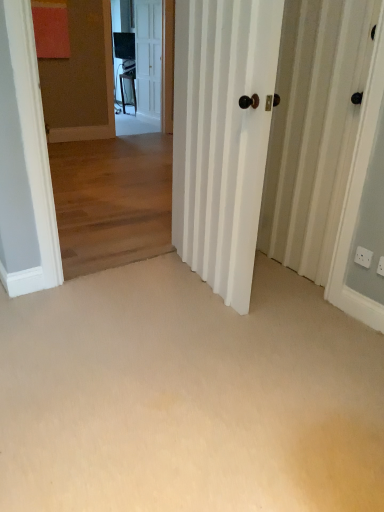
This screenshot has height=512, width=384. Find the location of `wooden floor at center, acting as the 2th corridor starting from the bottom`. wooden floor at center, acting as the 2th corridor starting from the bottom is located at coordinates (100, 158).

Describe the element at coordinates (314, 129) in the screenshot. The height and width of the screenshot is (512, 384). I see `white striped barn door at right` at that location.

This screenshot has width=384, height=512. Describe the element at coordinates (151, 55) in the screenshot. I see `white glossy screen door at upper center` at that location.

This screenshot has height=512, width=384. What do you see at coordinates (188, 396) in the screenshot?
I see `beige carpet at center, which appears as the first corridor when ordered from the bottom` at bounding box center [188, 396].

What do you see at coordinates (148, 57) in the screenshot?
I see `white wooden door at upper center, the 2th door ordered from the bottom` at bounding box center [148, 57].

At what (x,y) coordinates should I click in order to perform the action: click on white plastic electric outlet at lower right, positioned as the first electric outlet in back-to-front order. Please return your answer as a coordinate pair (x, y). The height and width of the screenshot is (512, 384). Looking at the image, I should click on (363, 257).

Can you confirm if white glossy door at center, which is counted as the 1th door, starting from the bottom, is bigger than white plastic electric outlet at lower right, arranged as the second electric outlet when viewed from the right?

Indeed, white glossy door at center, which is counted as the 1th door, starting from the bottom, has a larger size compared to white plastic electric outlet at lower right, arranged as the second electric outlet when viewed from the right.

Which point is more distant from viewer, [259,103] or [369,266]?

The point [369,266] is farther.

Is white glossy door at center, which appears as the first door when viewed from the right, not within white plastic electric outlet at lower right, the 1th electric outlet when ordered from left to right?

white glossy door at center, which appears as the first door when viewed from the right, is positioned outside white plastic electric outlet at lower right, the 1th electric outlet when ordered from left to right.

Is white plastic electric outlet at lower right, positioned as the first electric outlet in back-to-front order, at the back of white glossy door at center, the second door positioned from the back?

No, white glossy door at center, the second door positioned from the back,'s orientation is not away from white plastic electric outlet at lower right, positioned as the first electric outlet in back-to-front order.

Based on the photo, from a real-world perspective, is white glossy door at center, marked as the 2th door in a top-to-bottom arrangement, physically above white glossy screen door at upper center?

Incorrect, from a real-world perspective, white glossy door at center, marked as the 2th door in a top-to-bottom arrangement, is lower than white glossy screen door at upper center.

Considering the positions of objects white glossy door at center, marked as the first door in a front-to-back arrangement, and white glossy screen door at upper center in the image provided, who is more to the left, white glossy door at center, marked as the first door in a front-to-back arrangement, or white glossy screen door at upper center?

From the viewer's perspective, white glossy screen door at upper center appears more on the left side.

Is white glossy door at center, the second door positioned from the back, in front of or behind white glossy screen door at upper center in the image?

Clearly, white glossy door at center, the second door positioned from the back, is in front of white glossy screen door at upper center.

Considering the relative sizes of white glossy door at center, marked as the first door in a front-to-back arrangement, and beige carpet at center, which is counted as the second corridor, starting from the top, in the image provided, is white glossy door at center, marked as the first door in a front-to-back arrangement, thinner than beige carpet at center, which is counted as the second corridor, starting from the top,?

Yes, white glossy door at center, marked as the first door in a front-to-back arrangement, is thinner than beige carpet at center, which is counted as the second corridor, starting from the top.

Based on their positions, is white glossy door at center, which appears as the first door when viewed from the right, located to the left or right of beige carpet at center, which appears as the first corridor when ordered from the bottom?

In the image, white glossy door at center, which appears as the first door when viewed from the right, appears on the right side of beige carpet at center, which appears as the first corridor when ordered from the bottom.

Which of these two, white glossy door at center, which is counted as the 1th door, starting from the bottom, or beige carpet at center, which is counted as the second corridor, starting from the top, is smaller?

beige carpet at center, which is counted as the second corridor, starting from the top.

In terms of height, does wooden floor at center, the 1th corridor when ordered from top to bottom, look taller or shorter compared to white glossy screen door at upper center?

Considering their sizes, wooden floor at center, the 1th corridor when ordered from top to bottom, has less height than white glossy screen door at upper center.

Would you say wooden floor at center, acting as the 2th corridor starting from the bottom, is inside or outside white glossy screen door at upper center?

wooden floor at center, acting as the 2th corridor starting from the bottom, is not inside white glossy screen door at upper center, it's outside.

Would you say white striped barn door at right is inside or outside white glossy screen door at upper center?

white striped barn door at right is not inside white glossy screen door at upper center, it's outside.

Are white striped barn door at right and white glossy screen door at upper center located far from each other?

Absolutely, white striped barn door at right is distant from white glossy screen door at upper center.

Considering the relative sizes of white striped barn door at right and white glossy screen door at upper center in the image provided, is white striped barn door at right thinner than white glossy screen door at upper center?

Yes, white striped barn door at right is thinner than white glossy screen door at upper center.

Between white plastic electric outlet at lower right, arranged as the second electric outlet when viewed from the back, and white wooden door at upper center, the second door positioned from the right, which one has larger size?

Bigger between the two is white wooden door at upper center, the second door positioned from the right.

From the image's perspective, is white plastic electric outlet at lower right, arranged as the second electric outlet when viewed from the back, located beneath white wooden door at upper center, the second door positioned from the right?

Yes, from the image's perspective, white plastic electric outlet at lower right, arranged as the second electric outlet when viewed from the back, is below white wooden door at upper center, the second door positioned from the right.

Is white plastic electric outlet at lower right, which ranks as the 2th electric outlet in left-to-right order, shorter than white wooden door at upper center, arranged as the first door when viewed from the top?

Yes.

At what (x,y) coordinates should I click in order to perform the action: click on the 2nd electric outlet located beneath the white wooden door at upper center, the 2th door ordered from the bottom (from a real-world perspective). Please return your answer as a coordinate pair (x, y). The image size is (384, 512). Looking at the image, I should click on (380, 266).

Which is behind, white glossy screen door at upper center or white plastic electric outlet at lower right, arranged as the second electric outlet when viewed from the right?

Positioned behind is white glossy screen door at upper center.

Between white glossy screen door at upper center and white plastic electric outlet at lower right, the 1th electric outlet when ordered from left to right, which one appears on the right side from the viewer's perspective?

Positioned to the right is white plastic electric outlet at lower right, the 1th electric outlet when ordered from left to right.

Could you tell me if white glossy screen door at upper center is facing white plastic electric outlet at lower right, arranged as the second electric outlet when viewed from the right?

Yes, white glossy screen door at upper center is facing white plastic electric outlet at lower right, arranged as the second electric outlet when viewed from the right.

How much distance is there between white glossy screen door at upper center and white plastic electric outlet at lower right, arranged as the second electric outlet when viewed from the right?

A distance of 5.24 meters exists between white glossy screen door at upper center and white plastic electric outlet at lower right, arranged as the second electric outlet when viewed from the right.

At what (x,y) coordinates should I click in order to perform the action: click on electric outlet that is the 1st object located below the white glossy door at center, the second door positioned from the back (from the image's perspective). Please return your answer as a coordinate pair (x, y). The width and height of the screenshot is (384, 512). Looking at the image, I should click on (363, 257).

There is a white glossy door at center, which appears as the 2th door when viewed from the left. Identify the location of screen door above it (from a real-world perspective). This screenshot has width=384, height=512. (151, 55).

Considering their positions, is white striped barn door at right positioned closer to white glossy screen door at upper center than white glossy door at center, marked as the 2th door in a top-to-bottom arrangement?

Based on the image, white glossy door at center, marked as the 2th door in a top-to-bottom arrangement, appears to be nearer to white glossy screen door at upper center.

Looking at the image, which one is located closer to white plastic electric outlet at lower right, the 1th electric outlet when ordered from left to right, white plastic electric outlet at lower right, arranged as the second electric outlet when viewed from the back, or white wooden door at upper center, which ranks as the 2th door in front-to-back order?

white plastic electric outlet at lower right, arranged as the second electric outlet when viewed from the back, is positioned closer to the anchor white plastic electric outlet at lower right, the 1th electric outlet when ordered from left to right.

From the image, which object appears to be nearer to white striped barn door at right, white plastic electric outlet at lower right, positioned as the first electric outlet in back-to-front order, or wooden floor at center, the 1th corridor when ordered from top to bottom?

Based on the image, white plastic electric outlet at lower right, positioned as the first electric outlet in back-to-front order, appears to be nearer to white striped barn door at right.

Estimate the real-world distances between objects in this image. Which object is closer to white striped barn door at right, white plastic electric outlet at lower right, arranged as the second electric outlet when viewed from the right, or white glossy screen door at upper center?

Based on the image, white plastic electric outlet at lower right, arranged as the second electric outlet when viewed from the right, appears to be nearer to white striped barn door at right.

When comparing their distances from white glossy door at center, marked as the 2th door in a top-to-bottom arrangement, does white plastic electric outlet at lower right, the 2th electric outlet when ordered from front to back, or white glossy screen door at upper center seem closer?

Among the two, white plastic electric outlet at lower right, the 2th electric outlet when ordered from front to back, is located nearer to white glossy door at center, marked as the 2th door in a top-to-bottom arrangement.

When comparing their distances from white glossy door at center, which appears as the first door when viewed from the right, does wooden floor at center, the 1th corridor when ordered from top to bottom, or white glossy screen door at upper center seem further?

white glossy screen door at upper center.

When comparing their distances from white plastic electric outlet at lower right, arranged as the 1th electric outlet when viewed from the right, does beige carpet at center, which appears as the first corridor when ordered from the bottom, or white plastic electric outlet at lower right, the 1th electric outlet when ordered from left to right, seem further?

beige carpet at center, which appears as the first corridor when ordered from the bottom.

Looking at this image, which object lies nearer to the anchor point white glossy door at center, which appears as the first door when viewed from the right, beige carpet at center, which is counted as the second corridor, starting from the top, or white plastic electric outlet at lower right, which ranks as the 2th electric outlet in left-to-right order?

beige carpet at center, which is counted as the second corridor, starting from the top, lies closer to white glossy door at center, which appears as the first door when viewed from the right, than the other object.

This screenshot has height=512, width=384. Identify the location of door located between beige carpet at center, which is counted as the second corridor, starting from the top, and white plastic electric outlet at lower right, the 2th electric outlet when ordered from front to back, in the depth direction. (222, 136).

This screenshot has width=384, height=512. Find the location of `screen door located between white plastic electric outlet at lower right, arranged as the second electric outlet when viewed from the right, and white wooden door at upper center, which appears as the first door when viewed from the left, in the depth direction`. screen door located between white plastic electric outlet at lower right, arranged as the second electric outlet when viewed from the right, and white wooden door at upper center, which appears as the first door when viewed from the left, in the depth direction is located at coordinates (151, 55).

This screenshot has height=512, width=384. I want to click on barn door between beige carpet at center, which is counted as the second corridor, starting from the top, and white plastic electric outlet at lower right, arranged as the 1th electric outlet when viewed from the right, from front to back, so click(x=314, y=129).

The width and height of the screenshot is (384, 512). In order to click on barn door located between white glossy door at center, which appears as the 2th door when viewed from the left, and white plastic electric outlet at lower right, arranged as the second electric outlet when viewed from the right, in the left-right direction in this screenshot , I will do `click(314, 129)`.